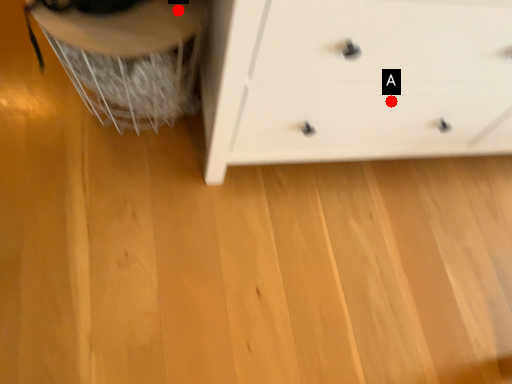
Question: Two points are circled on the image, labeled by A and B beside each circle. Which of the following is the closest to the observer?

Choices:
 (A) A is closer
 (B) B is closer

Answer: (B)